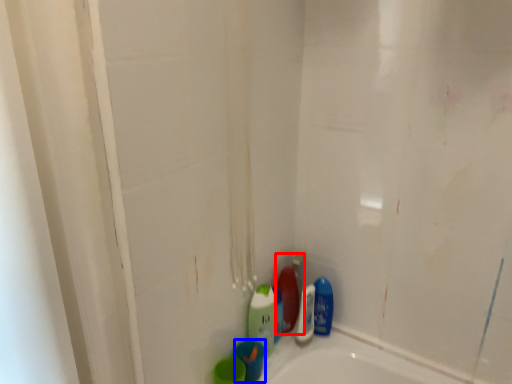
Question: Which object appears farthest to the camera in this image, cleaning product (highlighted by a red box) or mouthwash (highlighted by a blue box)?

Choices:
 (A) cleaning product
 (B) mouthwash

Answer: (A)